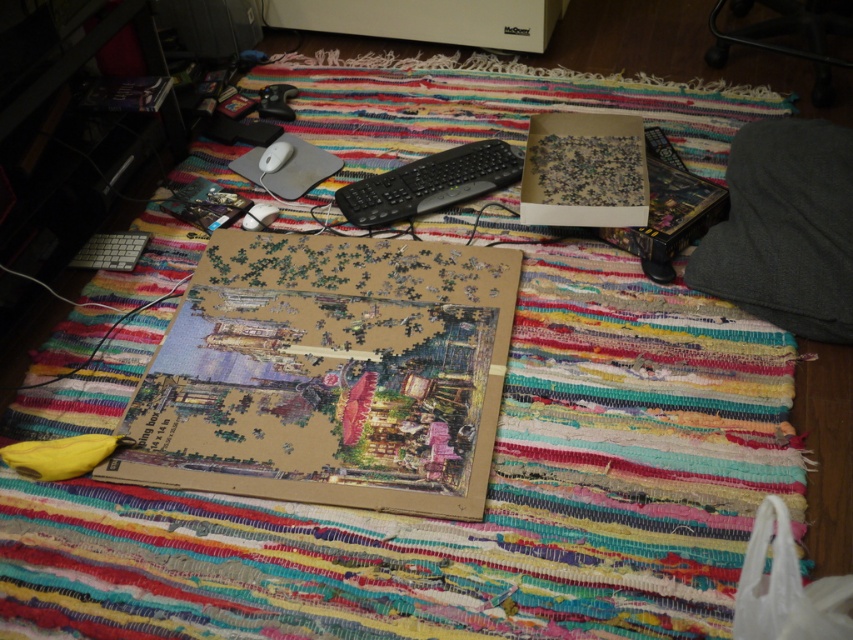
Does point (305, 358) lie behind point (596, 115)?

No, (305, 358) is in front of (596, 115).

Is wooden jigsaw puzzle at center taller than cardboard puzzle box at center?

Correct, wooden jigsaw puzzle at center is much taller as cardboard puzzle box at center.

Describe the element at coordinates (328, 374) in the screenshot. Image resolution: width=853 pixels, height=640 pixels. I see `wooden jigsaw puzzle at center` at that location.

Identify the location of wooden jigsaw puzzle at center. (328, 374).